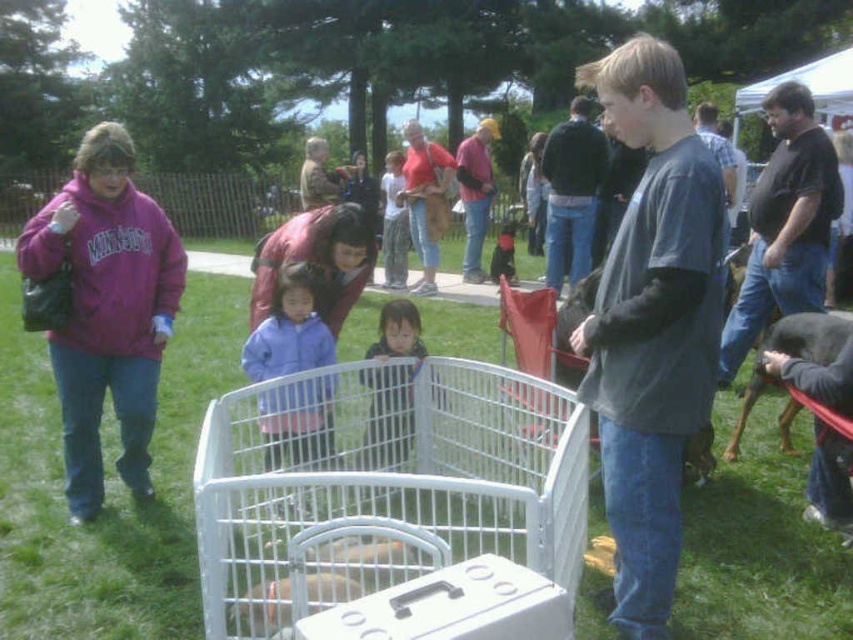
Question: Does dark blue fabric jacket at center appear under black glossy dog at right?

Choices:
 (A) yes
 (B) no

Answer: (B)

Question: Which point is farther to the camera?

Choices:
 (A) (318, 417)
 (B) (701, 314)
 (C) (155, 246)

Answer: (A)

Question: Which point is closer to the camera?

Choices:
 (A) black glossy dog at right
 (B) dark blue fabric jacket at center

Answer: (A)

Question: Can you confirm if matte purple sweatshirt at left is positioned above purple fleece jacket at center?

Choices:
 (A) no
 (B) yes

Answer: (B)

Question: Which of the following is the closest to the observer?

Choices:
 (A) pyautogui.click(x=622, y=429)
 (B) pyautogui.click(x=820, y=358)
 (C) pyautogui.click(x=407, y=417)

Answer: (A)

Question: Is matte purple sweatshirt at left further to the viewer compared to dark blue fabric jacket at center?

Choices:
 (A) yes
 (B) no

Answer: (B)